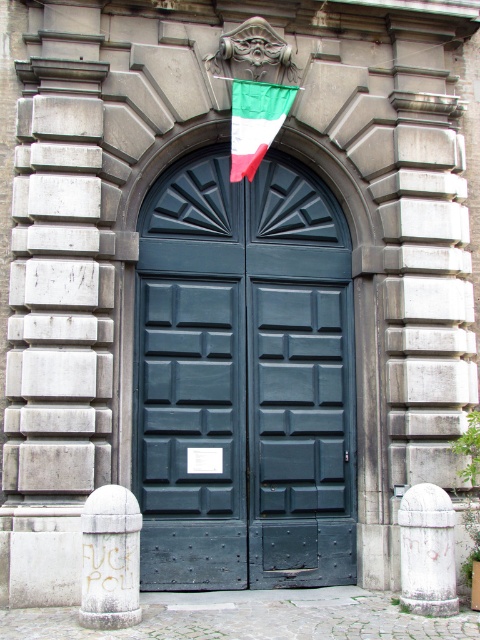
Question: Is matte dark green door at center to the left of white stone pillar at lower right from the viewer's perspective?

Choices:
 (A) no
 (B) yes

Answer: (B)

Question: Is matte dark green door at center in front of white stone bollard at lower left?

Choices:
 (A) yes
 (B) no

Answer: (B)

Question: Among these objects, which one is farthest from the camera?

Choices:
 (A) white stone bollard at lower left
 (B) matte dark green door at center
 (C) white stone pillar at lower right
 (D) green fabric flag at center

Answer: (D)

Question: Is white stone bollard at lower left behind white stone pillar at lower right?

Choices:
 (A) yes
 (B) no

Answer: (B)

Question: Considering the real-world distances, which object is closest to the white stone pillar at lower right?

Choices:
 (A) matte dark green door at center
 (B) green fabric flag at center
 (C) white stone bollard at lower left

Answer: (A)

Question: Which object is positioned closest to the white stone pillar at lower right?

Choices:
 (A) white stone bollard at lower left
 (B) matte dark green door at center
 (C) green fabric flag at center

Answer: (B)